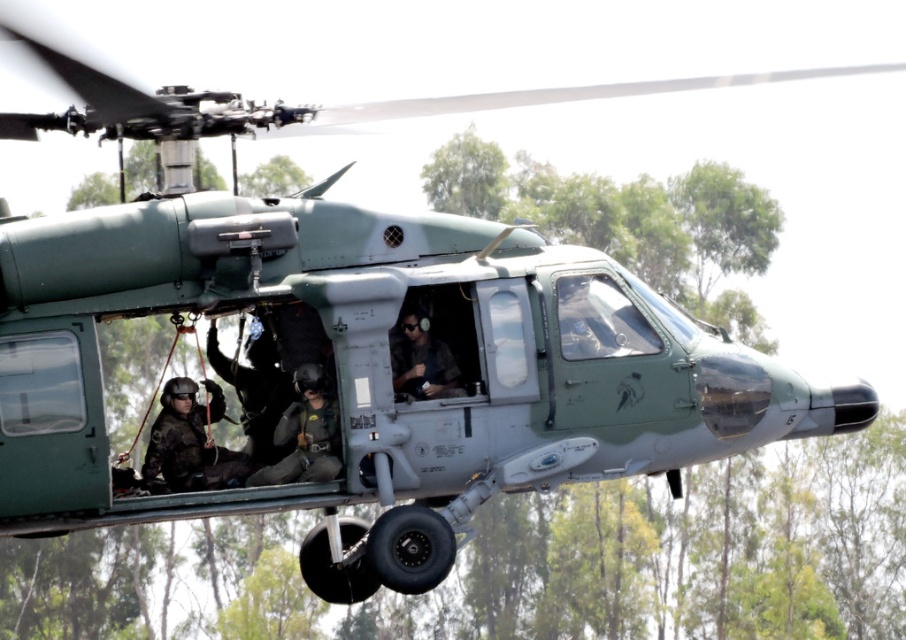
You are a military observer trying to identify the roles of the two crew members inside the helicopter. The camouflage fabric helmet at center and the matte black helmet at center are both visible from your vantage point. Which crew member is closer to you?

The camouflage fabric helmet at center is closer to you because it is in front of the matte black helmet at center.

You are a military analyst reviewing this helicopter image. You need to locate the camouflage fabric helmet at center. Where exactly is it positioned in the image coordinates?

The camouflage fabric helmet at center is positioned at point coordinates of 0.678 on the x axis and 0.338 on the y axis.

You are a military analyst observing the helicopter. Can you determine if the black tactical vest at center is located above or below the camouflage fabric helmet at center based on the image?

The black tactical vest at center is positioned under the camouflage fabric helmet at center, so it is below it.